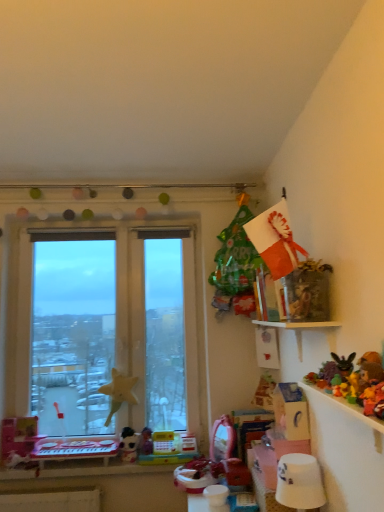
Question: Which direction should I rotate to look at white plush toy at lower center, which is the first toy from bottom to top?

Choices:
 (A) right
 (B) left

Answer: (B)

Question: Does white glossy lampshade at lower right have a lesser height compared to fluffy yellow teddy bear at upper right, positioned as the 4th toy in bottom-to-top order?

Choices:
 (A) yes
 (B) no

Answer: (B)

Question: Does white glossy lampshade at lower right have a larger size compared to fluffy yellow teddy bear at upper right, positioned as the 4th toy in bottom-to-top order?

Choices:
 (A) no
 (B) yes

Answer: (B)

Question: From the image's perspective, is white glossy lampshade at lower right under fluffy yellow teddy bear at upper right, the third toy viewed from the back?

Choices:
 (A) no
 (B) yes

Answer: (B)

Question: Are white glossy lampshade at lower right and fluffy yellow teddy bear at upper right, which is counted as the fourth toy, starting from the left, far apart?

Choices:
 (A) no
 (B) yes

Answer: (A)

Question: Is white glossy lampshade at lower right positioned in front of fluffy yellow teddy bear at upper right, the 1th toy positioned from the top?

Choices:
 (A) no
 (B) yes

Answer: (A)

Question: From a real-world perspective, is white glossy lampshade at lower right located higher than fluffy yellow teddy bear at upper right, which is counted as the fourth toy, starting from the left?

Choices:
 (A) no
 (B) yes

Answer: (A)

Question: Is white plastic table at lower left to the left of fluffy yellow teddy bear at upper right, the 2th toy when ordered from front to back, from the viewer's perspective?

Choices:
 (A) yes
 (B) no

Answer: (A)

Question: Is white plastic table at lower left in front of fluffy yellow teddy bear at upper right, which is counted as the fourth toy, starting from the left?

Choices:
 (A) no
 (B) yes

Answer: (A)

Question: Is there a large distance between white plastic table at lower left and fluffy yellow teddy bear at upper right, the 2th toy when ordered from front to back?

Choices:
 (A) yes
 (B) no

Answer: (A)

Question: From the image's perspective, is white plastic table at lower left on fluffy yellow teddy bear at upper right, the 1th toy positioned from the top?

Choices:
 (A) yes
 (B) no

Answer: (B)

Question: Can you see white plastic table at lower left touching fluffy yellow teddy bear at upper right, the third toy viewed from the back?

Choices:
 (A) no
 (B) yes

Answer: (A)

Question: Would you say white plastic table at lower left is outside fluffy yellow teddy bear at upper right, the 1th toy positioned from the top?

Choices:
 (A) yes
 (B) no

Answer: (A)

Question: Is transparent glass window at left positioned in front of fluffy yellow teddy bear at upper right, which is counted as the fourth toy, starting from the left?

Choices:
 (A) yes
 (B) no

Answer: (B)